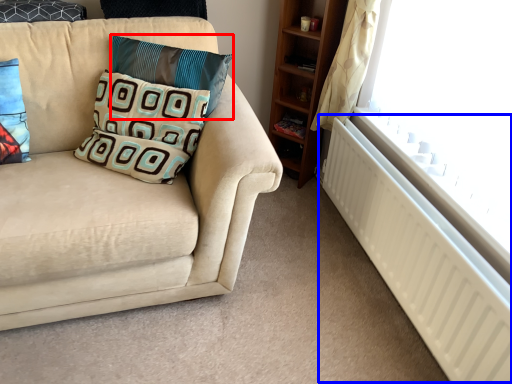
Question: Among these objects, which one is farthest to the camera, pillow (highlighted by a red box) or radiator (highlighted by a blue box)?

Choices:
 (A) pillow
 (B) radiator

Answer: (A)